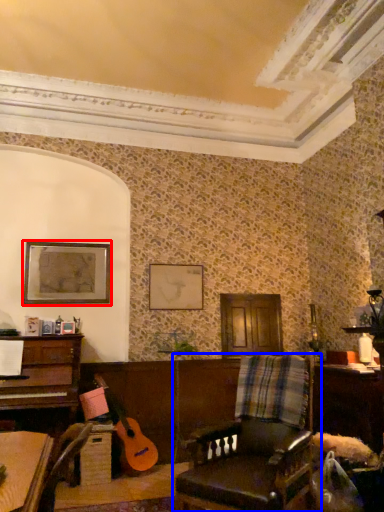
Question: Among these objects, which one is nearest to the camera, picture frame (highlighted by a red box) or chair (highlighted by a blue box)?

Choices:
 (A) picture frame
 (B) chair

Answer: (B)